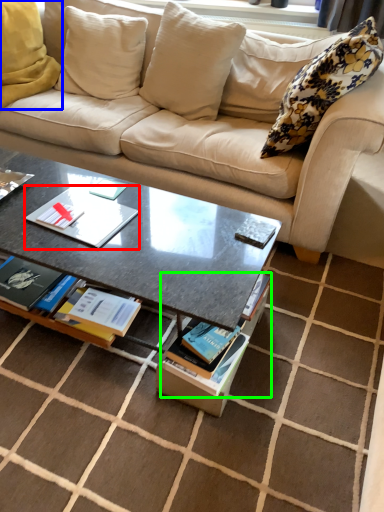
Question: Considering the real-world distances, which object is closest to paperback book (highlighted by a red box)? pillow (highlighted by a blue box) or magazine (highlighted by a green box).

Choices:
 (A) pillow
 (B) magazine

Answer: (B)